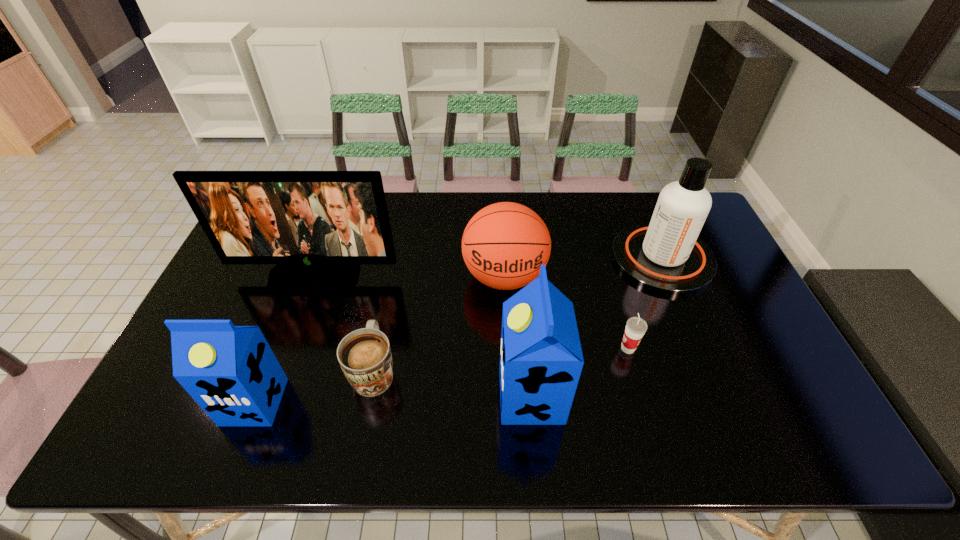
Identify the location of the shorter carton. The width and height of the screenshot is (960, 540). (231, 372).

Where is `the taller carton`? The height and width of the screenshot is (540, 960). the taller carton is located at coordinates (541, 359).

The width and height of the screenshot is (960, 540). What are the coordinates of `the third shortest object` in the screenshot? It's located at (504, 245).

Identify the location of monitor. The height and width of the screenshot is (540, 960). (317, 226).

Where is `the rightmost object`? Image resolution: width=960 pixels, height=540 pixels. the rightmost object is located at coordinates (666, 256).

The image size is (960, 540). I want to click on the second object from right to left, so click(636, 327).

The image size is (960, 540). Find the location of `mug`. mug is located at coordinates (364, 355).

Where is `vacant space located with the cap open on the right carton`? Image resolution: width=960 pixels, height=540 pixels. vacant space located with the cap open on the right carton is located at coordinates (410, 395).

Where is `vacant space located 0.160m with the cap open on the right carton`? vacant space located 0.160m with the cap open on the right carton is located at coordinates (434, 395).

You are a GUI agent. You are given a task and a screenshot of the screen. Output one action in this format:
    pyautogui.click(x=<x>, y=<y>)
    Task: Click on the blank space located with the cap open on the right carton
    The width and height of the screenshot is (960, 540).
    Given the screenshot: What is the action you would take?
    pyautogui.click(x=345, y=395)